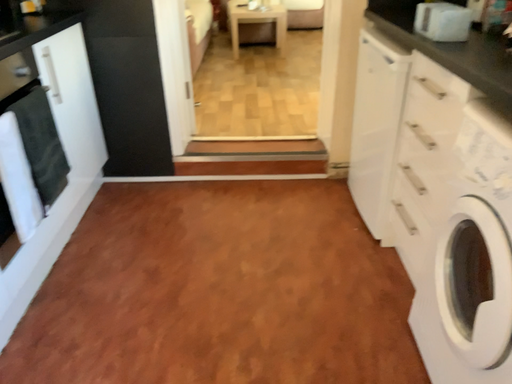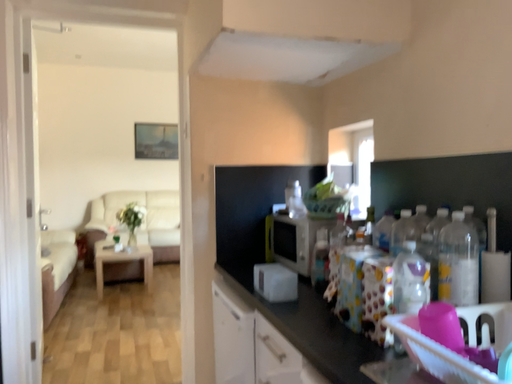
Question: Which way did the camera rotate in the video?

Choices:
 (A) rotated left
 (B) rotated right

Answer: (B)